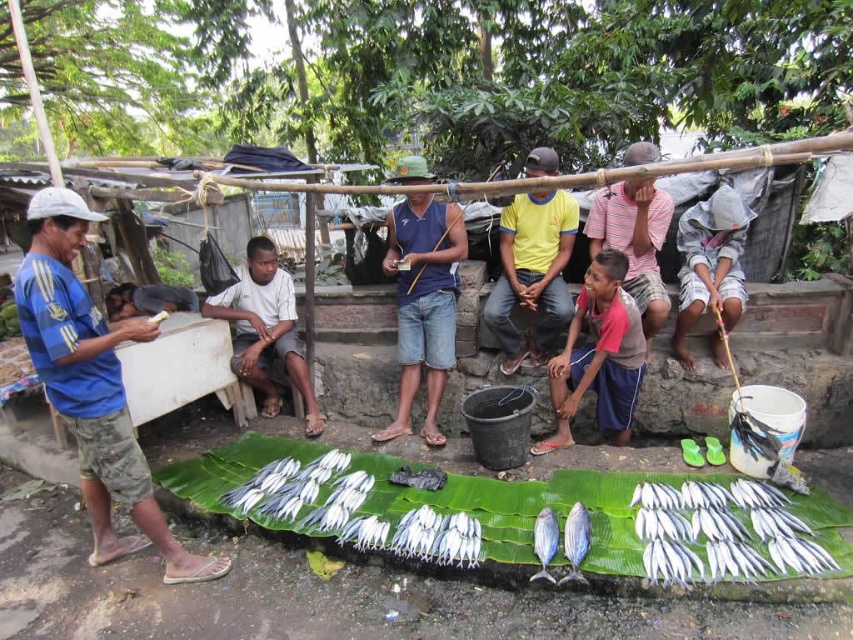
Question: Does blue denim shorts at center lie behind white cotton hat at upper right?

Choices:
 (A) no
 (B) yes

Answer: (B)

Question: Is blue striped shirt at left positioned behind red cotton shirt at center?

Choices:
 (A) no
 (B) yes

Answer: (A)

Question: Which point is closer to the camera?

Choices:
 (A) (738, 577)
 (B) (428, 358)

Answer: (A)

Question: Among these points, which one is nearest to the camera?

Choices:
 (A) (535, 328)
 (B) (631, 280)

Answer: (B)

Question: Which point is farther to the camera?

Choices:
 (A) white cotton hat at upper right
 (B) blue denim shorts at center
 (C) shiny silver fish at center

Answer: (B)

Question: Is yellow cotton shirt at center positioned in front of striped cotton shirt at center?

Choices:
 (A) no
 (B) yes

Answer: (A)